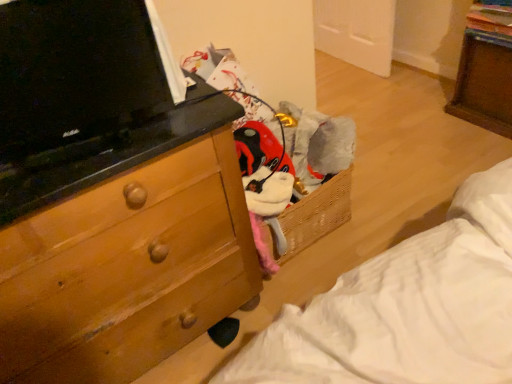
What do you see at coordinates (126, 270) in the screenshot?
I see `wooden chest of drawers at left` at bounding box center [126, 270].

The width and height of the screenshot is (512, 384). I want to click on wooden chest of drawers at left, so click(x=126, y=270).

In order to face black glossy tv at upper left, should I rotate leftwards or rightwards?

You should look left and rotate roughly 24.177 degrees.

You are a GUI agent. You are given a task and a screenshot of the screen. Output one action in this format:
    pyautogui.click(x=<x>, y=<y>)
    Task: Click on the black glossy tv at upper left
    Image resolution: width=512 pixels, height=384 pixels.
    Given the screenshot: What is the action you would take?
    pyautogui.click(x=78, y=71)

The image size is (512, 384). Describe the element at coordinates (78, 71) in the screenshot. I see `black glossy tv at upper left` at that location.

Image resolution: width=512 pixels, height=384 pixels. Find the location of `wooden chest of drawers at left`. wooden chest of drawers at left is located at coordinates (126, 270).

Is black glossy tv at upper left to the right of wooden chest of drawers at left from the viewer's perspective?

Yes, black glossy tv at upper left is to the right of wooden chest of drawers at left.

Which object is further away from the camera, black glossy tv at upper left or wooden chest of drawers at left?

black glossy tv at upper left is further away from the camera.

Which is in front, point (126, 9) or point (74, 374)?

The point (126, 9) is closer.

From the image's perspective, is black glossy tv at upper left located above or below wooden chest of drawers at left?

black glossy tv at upper left is situated higher than wooden chest of drawers at left in the image.

From a real-world perspective, relative to wooden chest of drawers at left, is black glossy tv at upper left vertically above or below?

In terms of real-world spatial position, black glossy tv at upper left is above wooden chest of drawers at left.

Can you confirm if black glossy tv at upper left is thinner than wooden chest of drawers at left?

Yes, black glossy tv at upper left is thinner than wooden chest of drawers at left.

In terms of height, does black glossy tv at upper left look taller or shorter compared to wooden chest of drawers at left?

Considering their sizes, black glossy tv at upper left has less height than wooden chest of drawers at left.

Can you confirm if black glossy tv at upper left is smaller than wooden chest of drawers at left?

Correct, black glossy tv at upper left occupies less space than wooden chest of drawers at left.

Does black glossy tv at upper left contain wooden chest of drawers at left?

No, wooden chest of drawers at left is located outside of black glossy tv at upper left.

Is the surface of black glossy tv at upper left in direct contact with wooden chest of drawers at left?

No, black glossy tv at upper left is not in contact with wooden chest of drawers at left.

Is black glossy tv at upper left looking in the opposite direction of wooden chest of drawers at left?

No, black glossy tv at upper left's orientation is not away from wooden chest of drawers at left.

Image resolution: width=512 pixels, height=384 pixels. In order to click on chest of drawers in front of the black glossy tv at upper left in this screenshot , I will do `click(126, 270)`.

Considering the positions of objects wooden chest of drawers at left and black glossy tv at upper left in the image provided, who is more to the right, wooden chest of drawers at left or black glossy tv at upper left?

black glossy tv at upper left is more to the right.

Is wooden chest of drawers at left behind black glossy tv at upper left?

No, wooden chest of drawers at left is closer to the viewer.

Which is behind, point (139, 342) or point (6, 51)?

The point (139, 342) is farther from the camera.

From the image's perspective, is wooden chest of drawers at left over black glossy tv at upper left?

Incorrect, from the image's perspective, wooden chest of drawers at left is lower than black glossy tv at upper left.

In the scene shown: From a real-world perspective, which is physically above, wooden chest of drawers at left or black glossy tv at upper left?

In real-world perspective, black glossy tv at upper left is above.

Between wooden chest of drawers at left and black glossy tv at upper left, which one has larger width?

Wider between the two is wooden chest of drawers at left.

Considering the relative sizes of wooden chest of drawers at left and black glossy tv at upper left in the image provided, is wooden chest of drawers at left taller than black glossy tv at upper left?

Indeed, wooden chest of drawers at left has a greater height compared to black glossy tv at upper left.

Is wooden chest of drawers at left smaller than black glossy tv at upper left?

No.

Which is correct: wooden chest of drawers at left is inside black glossy tv at upper left, or outside of it?

wooden chest of drawers at left is outside black glossy tv at upper left.

Is wooden chest of drawers at left not near black glossy tv at upper left?

wooden chest of drawers at left is actually quite close to black glossy tv at upper left.

Could you tell me if wooden chest of drawers at left is turned towards black glossy tv at upper left?

No.

Can you tell me how much wooden chest of drawers at left and black glossy tv at upper left differ in facing direction?

15.4 degrees separate the facing orientations of wooden chest of drawers at left and black glossy tv at upper left.

Locate an element on the screen. computer behind the wooden chest of drawers at left is located at coordinates (78, 71).

Where is `the chest of drawers below the black glossy tv at upper left (from a real-world perspective)`? Image resolution: width=512 pixels, height=384 pixels. the chest of drawers below the black glossy tv at upper left (from a real-world perspective) is located at coordinates (126, 270).

Locate an element on the screen. This screenshot has width=512, height=384. computer on the right of wooden chest of drawers at left is located at coordinates (78, 71).